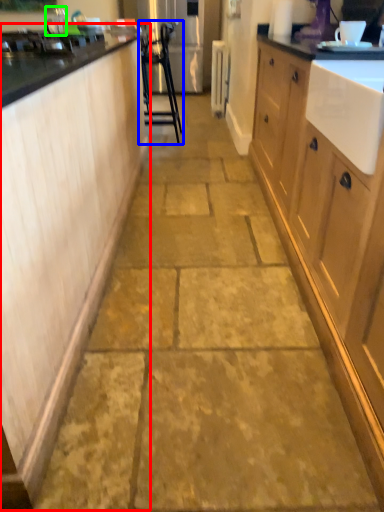
Question: Which object is the closest to the cabinetry (highlighted by a red box)? Choose among these: furniture (highlighted by a blue box) or faucet (highlighted by a green box).

Choices:
 (A) furniture
 (B) faucet

Answer: (B)